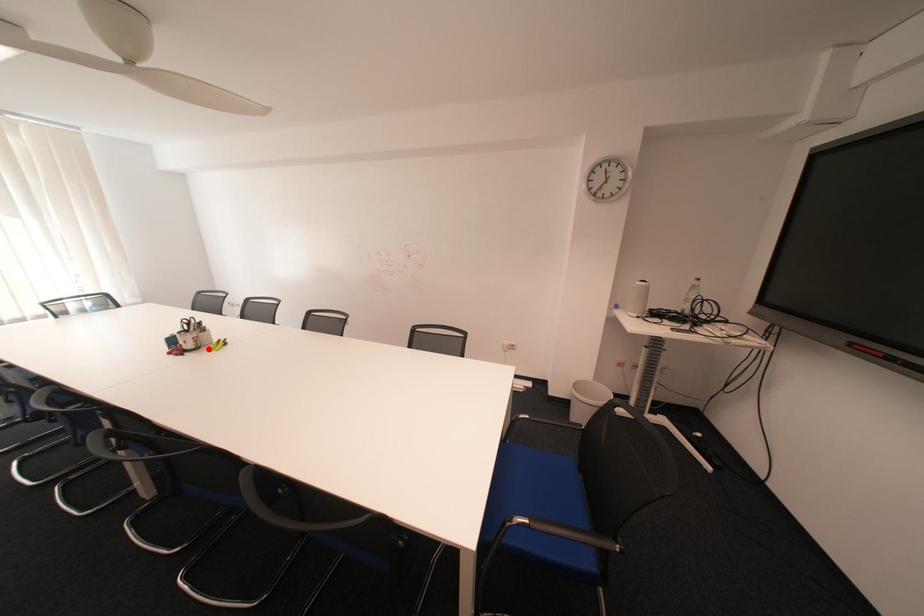
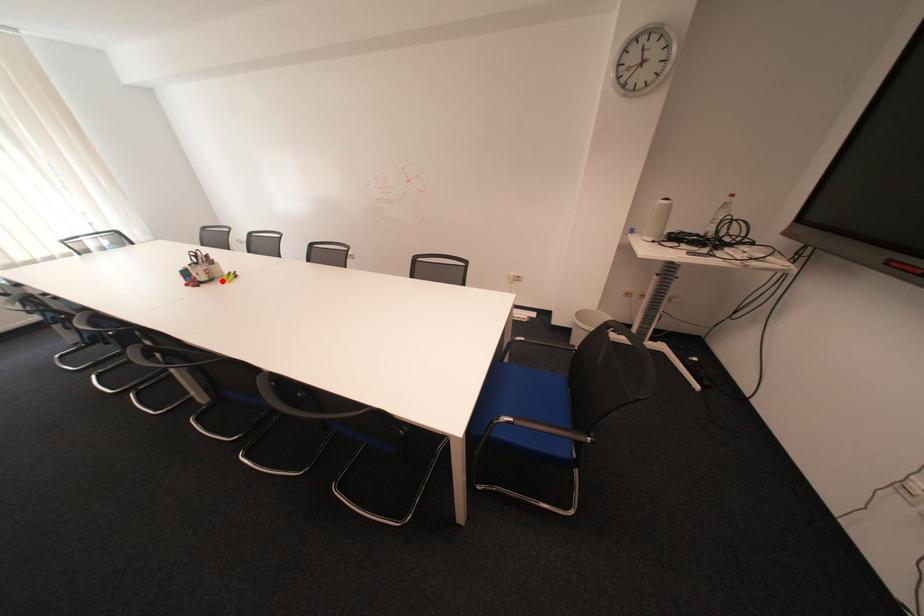
In the scene shown: I am providing you with two images of the same scene from different viewpoints. A red point is marked on the first image and another point is marked on the second image. Is the red point in image1 aligned with the point shown in image2?

Yes